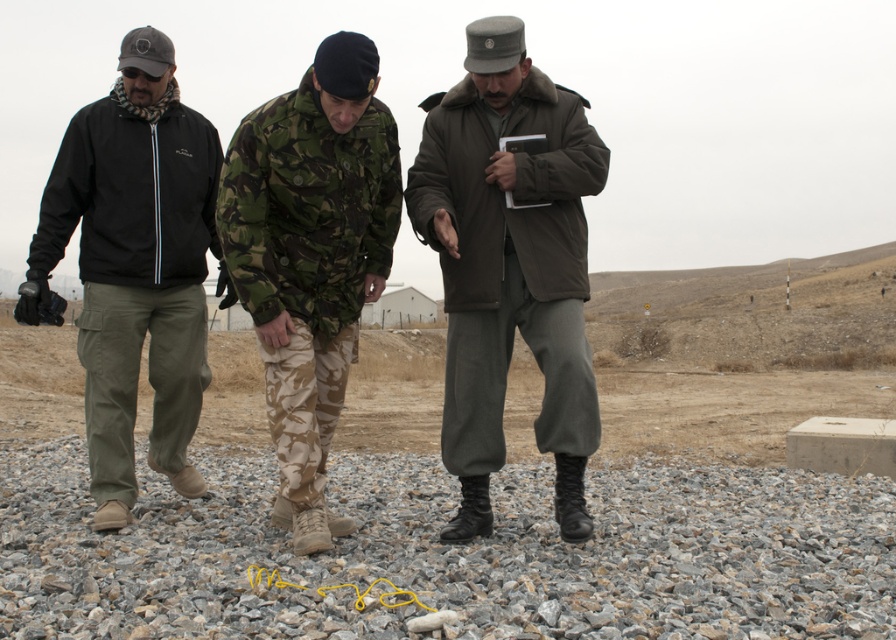
Question: Estimate the real-world distances between objects in this image. Which object is farther from the gray gravel at center?

Choices:
 (A) matte black jacket at left
 (B) camouflage fabric uniform at center
 (C) matte brown jacket at center

Answer: (A)

Question: Does matte brown jacket at center come in front of matte black jacket at left?

Choices:
 (A) no
 (B) yes

Answer: (B)

Question: Can you confirm if matte black jacket at left is positioned above camouflage fabric uniform at center?

Choices:
 (A) no
 (B) yes

Answer: (B)

Question: Where is gray gravel at center located in relation to matte brown jacket at center in the image?

Choices:
 (A) above
 (B) below

Answer: (B)

Question: Which is farther from the matte black jacket at left?

Choices:
 (A) camouflage fabric uniform at center
 (B) matte brown jacket at center
 (C) gray gravel at center

Answer: (C)

Question: Estimate the real-world distances between objects in this image. Which object is farther from the matte brown jacket at center?

Choices:
 (A) camouflage fabric uniform at center
 (B) matte black jacket at left
 (C) gray gravel at center

Answer: (C)